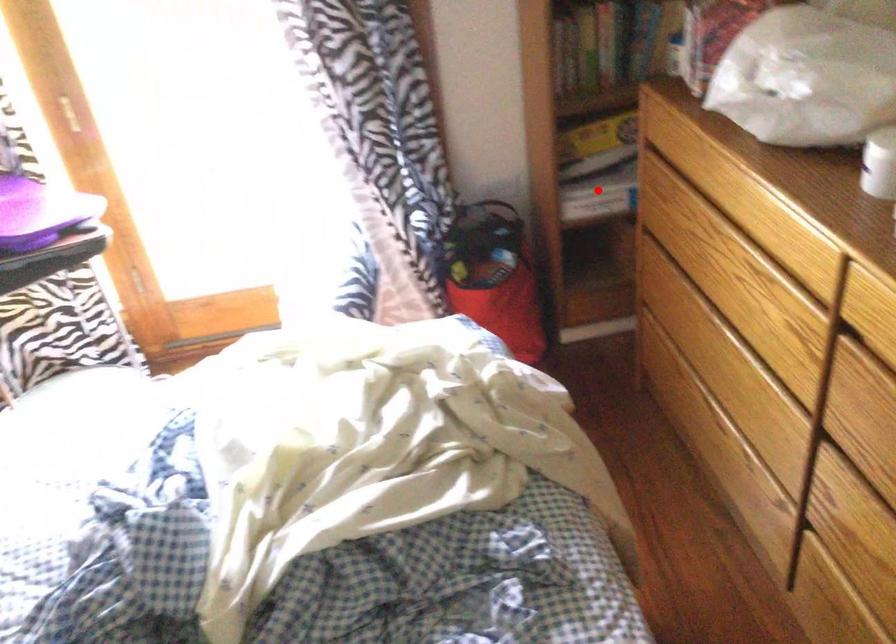
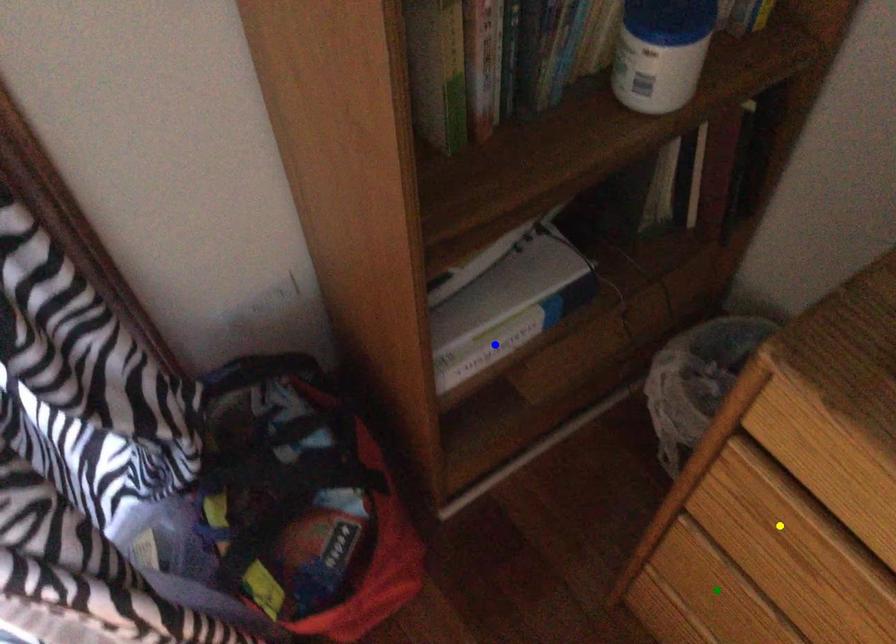
Question: I am providing you with two images of the same scene from different viewpoints. A red point is marked on the first image. You are given multiple points on the second image. Which point in image 2 is actually the same real-world point as the red point in image 1?

Choices:
 (A) blue point
 (B) yellow point
 (C) green point

Answer: (A)